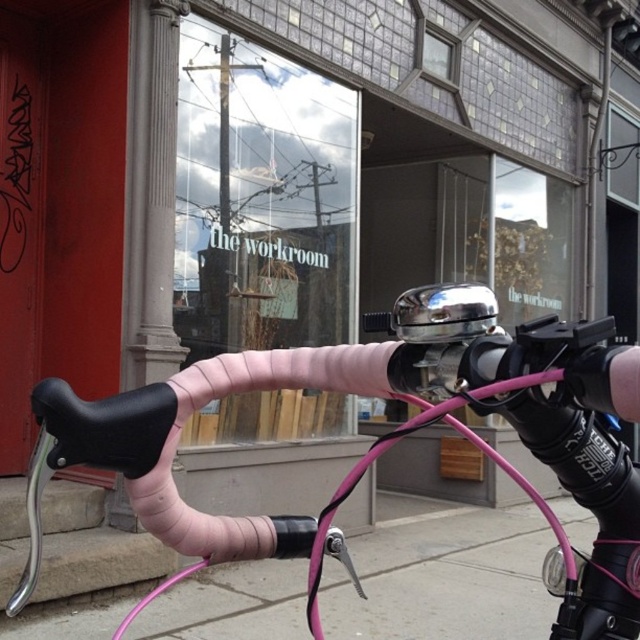
Question: Does pink matte handlebars at center appear on the left side of pink rubber handlebar at lower center?

Choices:
 (A) yes
 (B) no

Answer: (A)

Question: Which point is farther to the camera?

Choices:
 (A) (221, 525)
 (B) (268, 573)

Answer: (B)

Question: Which point appears closest to the camera in this image?

Choices:
 (A) (147, 612)
 (B) (612, 512)

Answer: (B)

Question: From the image, what is the correct spatial relationship of pink matte handlebars at center in relation to pink rubber handlebar at lower center?

Choices:
 (A) right
 (B) left

Answer: (B)

Question: Among these objects, which one is nearest to the camera?

Choices:
 (A) pink rubber handlebar at lower center
 (B) pink matte handlebars at center

Answer: (B)

Question: Is pink matte handlebars at center to the right of pink rubber handlebar at lower center from the viewer's perspective?

Choices:
 (A) yes
 (B) no

Answer: (B)